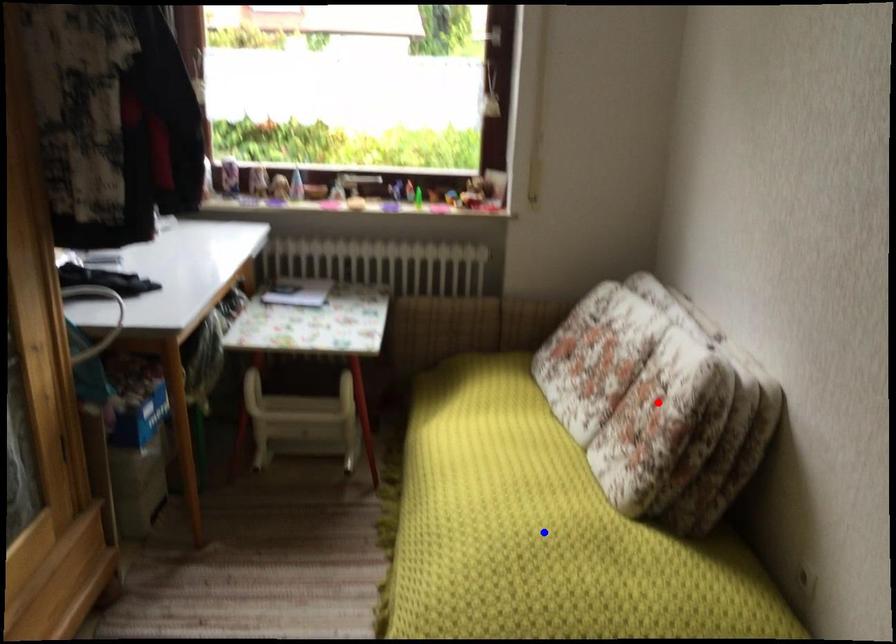
Question: In the image, two points are highlighted. Which point is nearer to the camera? Reply with the corresponding letter.

Choices:
 (A) blue point
 (B) red point

Answer: (A)